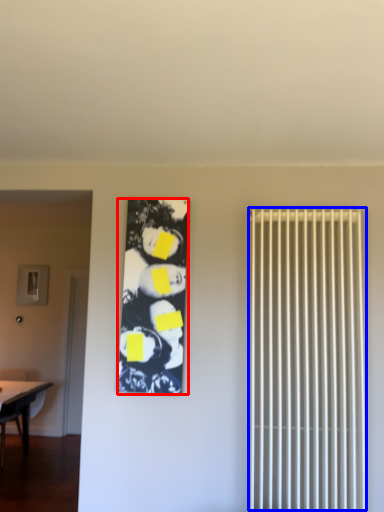
Question: Which of the following is the farthest to the observer, couple (highlighted by a red box) or radiator (highlighted by a blue box)?

Choices:
 (A) couple
 (B) radiator

Answer: (A)